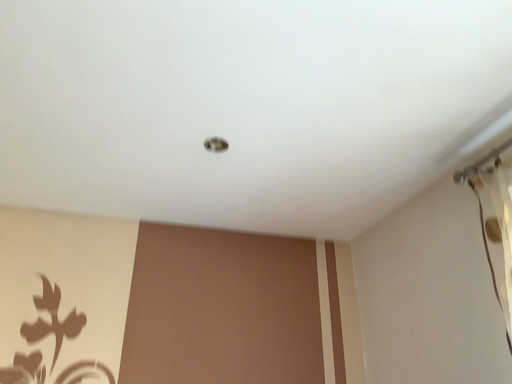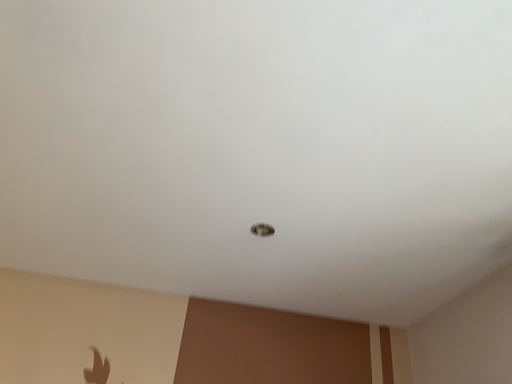
Question: How did the camera likely rotate when shooting the video?

Choices:
 (A) rotated downward
 (B) rotated upward

Answer: (B)